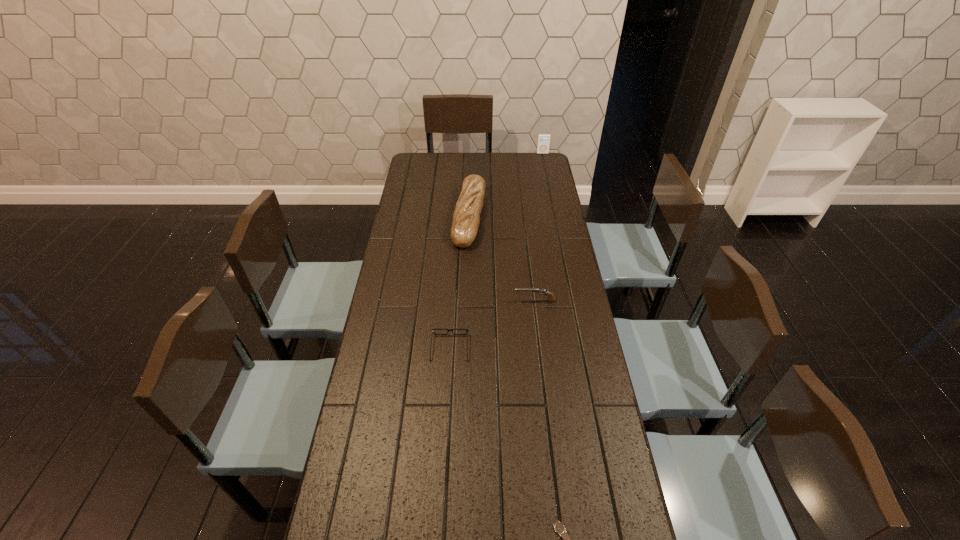
Identify the location of iPod. (543, 144).

This screenshot has height=540, width=960. In order to click on the rightmost object in this screenshot , I will do `click(543, 144)`.

The height and width of the screenshot is (540, 960). What are the coordinates of `baguet` in the screenshot? It's located at (466, 218).

The width and height of the screenshot is (960, 540). I want to click on gun, so click(x=551, y=298).

Where is `the third shortest object`? The image size is (960, 540). the third shortest object is located at coordinates (551, 298).

Find the location of `the fourth tallest object`. the fourth tallest object is located at coordinates (448, 330).

Find the location of a particular element. the second nearest object is located at coordinates (448, 330).

Locate an element on the screen. The width and height of the screenshot is (960, 540). vacant space situated 0.340m on the front-facing side of the rightmost object is located at coordinates (550, 189).

This screenshot has height=540, width=960. In order to click on vacant area located on the front of the baguet in this screenshot , I will do `click(467, 328)`.

I want to click on free region located aiming along the barrel of the gun, so click(492, 301).